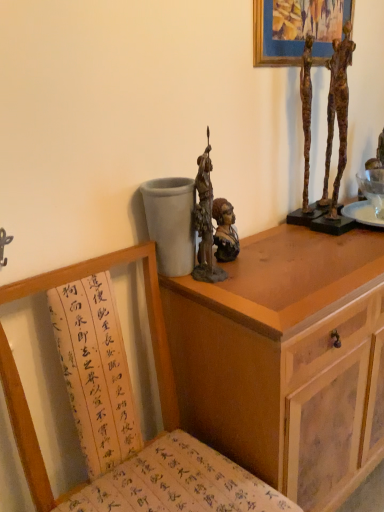
Where is `free space to the right of rusty bronze statue at center`? Image resolution: width=384 pixels, height=512 pixels. free space to the right of rusty bronze statue at center is located at coordinates (285, 268).